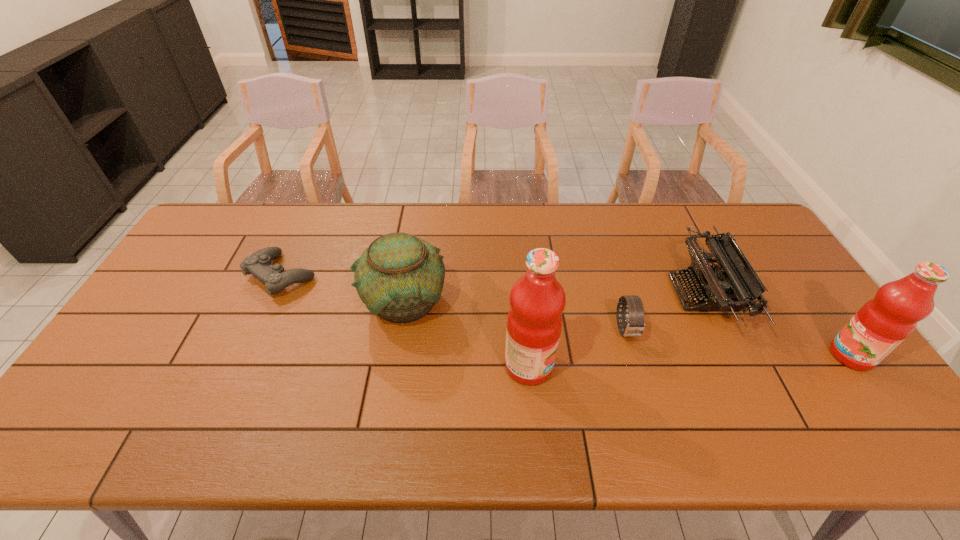
This screenshot has width=960, height=540. I want to click on vacant position located 0.180m on the typing side of the third shortest object, so click(613, 294).

Where is `vacant space located 0.150m on the typing side of the third shortest object`? This screenshot has height=540, width=960. vacant space located 0.150m on the typing side of the third shortest object is located at coordinates (623, 294).

The width and height of the screenshot is (960, 540). What are the coordinates of `object located in the near edge section of the desktop` in the screenshot? It's located at (537, 300).

I want to click on object situated at the right edge, so click(881, 324).

Identify the location of free space at the far edge of the desktop. The width and height of the screenshot is (960, 540). (476, 244).

Where is `vacant space at the near edge of the desktop`? Image resolution: width=960 pixels, height=540 pixels. vacant space at the near edge of the desktop is located at coordinates (762, 403).

In order to click on free region at the left edge of the desktop in this screenshot , I will do `click(142, 372)`.

Find the location of a particular element. The width and height of the screenshot is (960, 540). vacant space at the far right corner is located at coordinates (751, 244).

Where is `empty space that is in between the fifth object from right to left and the control`? This screenshot has height=540, width=960. empty space that is in between the fifth object from right to left and the control is located at coordinates (343, 288).

Locate an element on the screen. This screenshot has width=960, height=540. vacant point located between the fifth object from right to left and the left fruit juice is located at coordinates (467, 333).